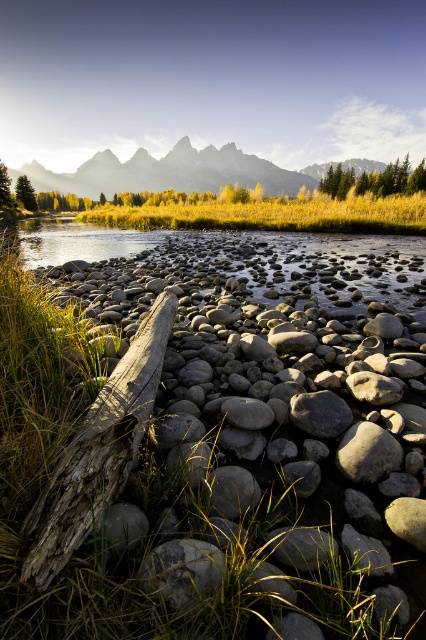
Who is shorter, smooth gray rock at lower center or green matte tree at center?

With less height is smooth gray rock at lower center.

Who is positioned more to the right, smooth gray rock at lower center or green matte tree at center?

smooth gray rock at lower center

The width and height of the screenshot is (426, 640). Describe the element at coordinates (181, 570) in the screenshot. I see `smooth gray rock at lower center` at that location.

You are a GUI agent. You are given a task and a screenshot of the screen. Output one action in this format:
    pyautogui.click(x=<x>, y=<y>)
    Task: Click on the smooth gray rock at lower center
    The height and width of the screenshot is (640, 426).
    Given the screenshot: What is the action you would take?
    pyautogui.click(x=181, y=570)

Does smooth gray rock at center have a larger size compared to green textured tree at upper center?

No.

Is smooth gray rock at center to the right of green textured tree at upper center from the viewer's perspective?

Incorrect, smooth gray rock at center is not on the right side of green textured tree at upper center.

Locate an element on the screen. smooth gray rock at center is located at coordinates (278, 432).

I want to click on smooth gray rock at center, so click(278, 432).

Who is shorter, smooth gray rock at center or silvery granite peaks at upper center?

With less height is smooth gray rock at center.

Where is `smooth gray rock at center`? smooth gray rock at center is located at coordinates (278, 432).

Which is behind, point (135, 268) or point (210, 154)?

The point (210, 154) is more distant.

This screenshot has height=640, width=426. Find the location of `smooth gray rock at center`. smooth gray rock at center is located at coordinates (278, 432).